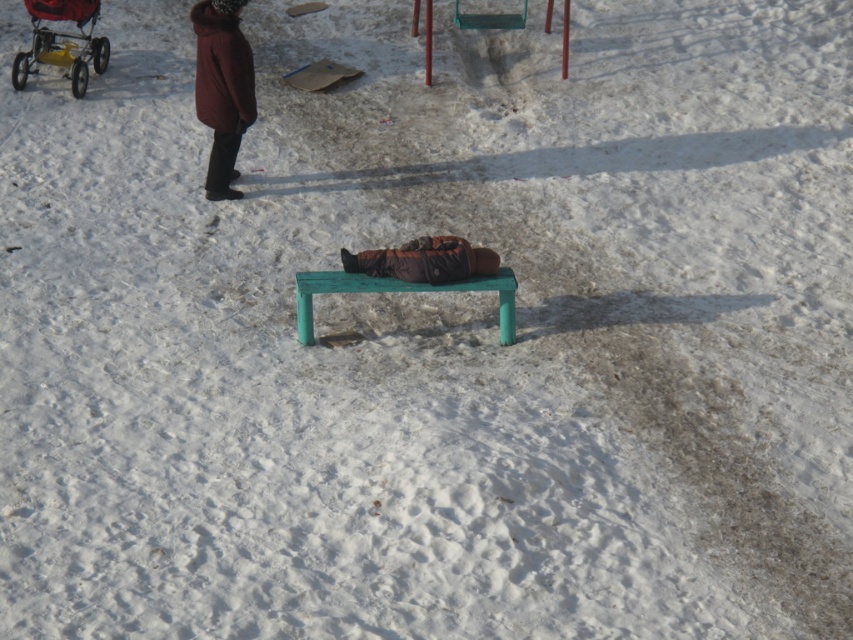
Does point (73, 54) come closer to viewer compared to point (305, 323)?

No, it is not.

Based on the photo, does yellow plastic baby carriage at upper left appear under green plastic bench at center?

No.

The image size is (853, 640). Find the location of `yellow plastic baby carriage at upper left`. yellow plastic baby carriage at upper left is located at coordinates (x=62, y=42).

Can you confirm if burgundy wool coat at upper left is bigger than brown fuzzy coat at center?

Yes.

Does burgundy wool coat at upper left have a greater height compared to brown fuzzy coat at center?

Yes.

Who is more forward, [200,99] or [370,262]?

Positioned in front is point [370,262].

Identify the location of burgundy wool coat at upper left. The image size is (853, 640). (222, 88).

Which of these two, yellow plastic baby carriage at upper left or brown fuzzy coat at center, stands taller?

yellow plastic baby carriage at upper left

Is yellow plastic baby carriage at upper left to the left of brown fuzzy coat at center from the viewer's perspective?

Indeed, yellow plastic baby carriage at upper left is positioned on the left side of brown fuzzy coat at center.

The width and height of the screenshot is (853, 640). What are the coordinates of `yellow plastic baby carriage at upper left` in the screenshot? It's located at (62, 42).